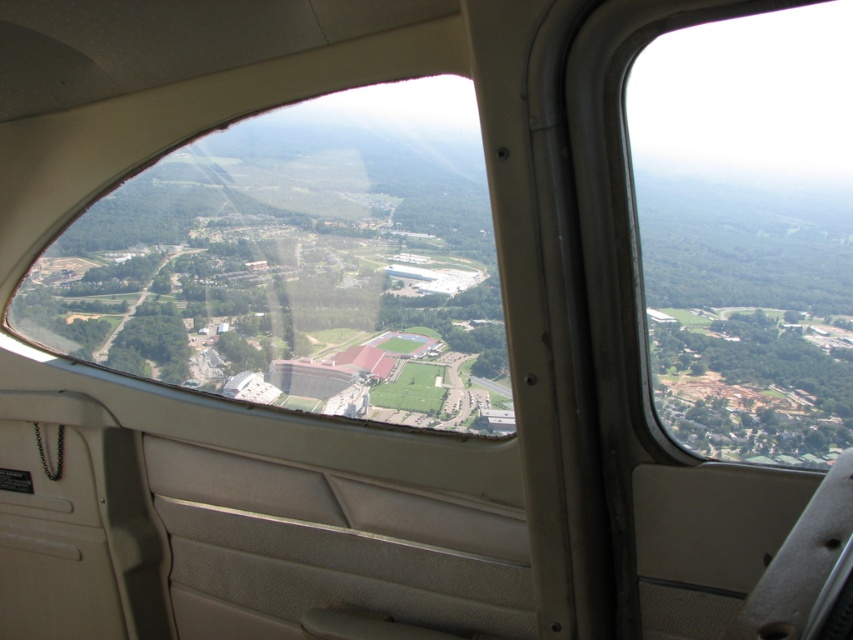
Question: Which point is closer to the camera?

Choices:
 (A) (770, 19)
 (B) (320, 294)

Answer: (B)

Question: Where is transparent glass airplane window at center located in relation to transparent glass airplane window at upper right in the image?

Choices:
 (A) below
 (B) above

Answer: (A)

Question: Can you confirm if transparent glass airplane window at center is positioned to the right of transparent glass airplane window at upper right?

Choices:
 (A) yes
 (B) no

Answer: (B)

Question: Which point is closer to the camera?

Choices:
 (A) transparent glass airplane window at upper right
 (B) transparent glass airplane window at center

Answer: (A)

Question: Is transparent glass airplane window at center further to camera compared to transparent glass airplane window at upper right?

Choices:
 (A) yes
 (B) no

Answer: (A)